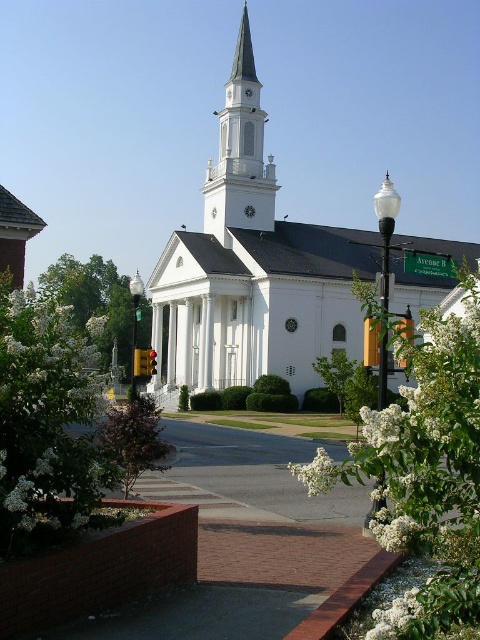
You are standing at the entrance of the church and looking towards the pathway. Which of the two white fluffy flowers is closer to you, the white fluffy flowers at center or the white fluffy flower at lower center?

The white fluffy flowers at center is closer to you because it is in front of the white fluffy flower at lower center.

In the scene shown: You are standing on the brick pathway in front of the church. You see the white fluffy flower at lower center and the green leafy tree at center. Which object is closer to you?

The white fluffy flower at lower center is closer to the viewer than the green leafy tree at center.

You are standing at the entrance of the white church with a black roof. You see a point marked at coordinates (316, 472). What object is located at this point?

The point at coordinates (316, 472) corresponds to the white fluffy flower at lower center.